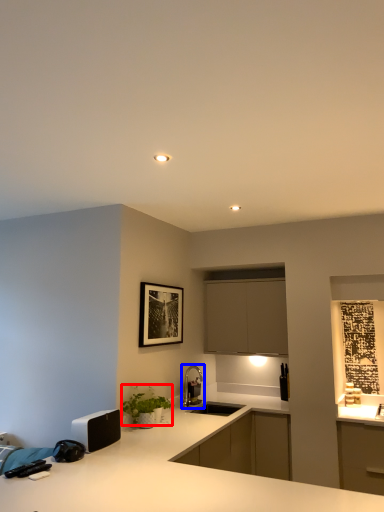
Question: Among these objects, which one is nearest to the camera, plant (highlighted by a red box) or tap (highlighted by a blue box)?

Choices:
 (A) plant
 (B) tap

Answer: (A)